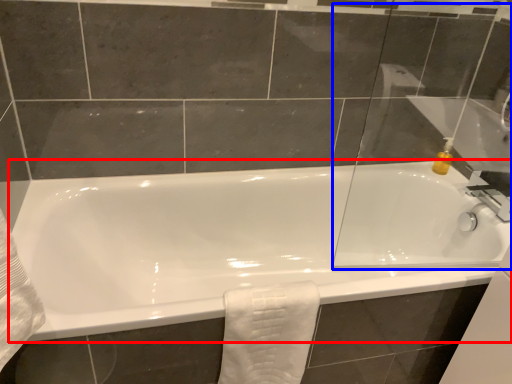
Question: Which of the following is the closest to the observer, bathtub (highlighted by a red box) or glass door (highlighted by a blue box)?

Choices:
 (A) bathtub
 (B) glass door

Answer: (B)